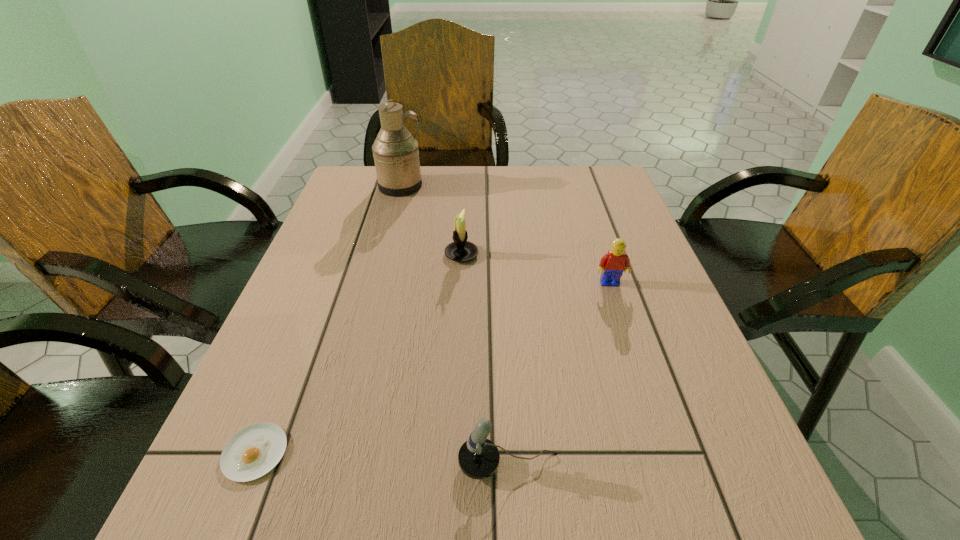
In order to click on vacant space that's between the microphone and the candle holder in this screenshot , I will do `click(485, 359)`.

At what (x,y) coordinates should I click in order to perform the action: click on vacant region between the rightmost object and the second farthest object. Please return your answer as a coordinate pair (x, y). The image size is (960, 540). Looking at the image, I should click on (536, 268).

Identify the location of free space between the egg yolk and the candle holder. (358, 354).

The image size is (960, 540). I want to click on empty location between the tallest object and the fourth nearest object, so click(x=431, y=220).

Select which object is the third closest to the egg yolk. Please provide its 2D coordinates. Your answer should be formatted as a tuple, i.e. [(x, y)], where the tuple contains the x and y coordinates of a point satisfying the conditions above.

[(613, 264)]

Locate which object is the third closest to the egg yolk. Please provide its 2D coordinates. Your answer should be formatted as a tuple, i.e. [(x, y)], where the tuple contains the x and y coordinates of a point satisfying the conditions above.

[(613, 264)]

The width and height of the screenshot is (960, 540). Identify the location of blank area in the image that satisfies the following two spatial constraints: 1. on the front side of the fourth nearest object; 2. on the left side of the pitcher. (383, 254).

Locate an element on the screen. The image size is (960, 540). vacant region that satisfies the following two spatial constraints: 1. on the back side of the candle holder; 2. on the right side of the egg yolk is located at coordinates (335, 254).